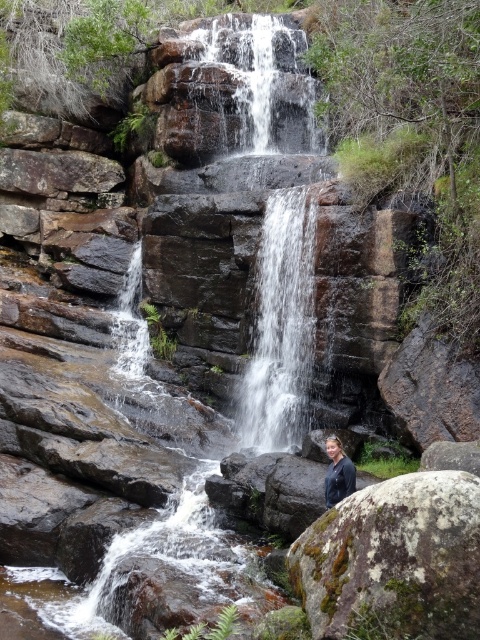
You are planning to cross the clear water at center to reach the mossy rock at lower right. Considering the width of both, which one is wider?

The mossy rock at lower right is wider than the clear water at center, so the mossy rock at lower right is wider.

You are a photographer trying to capture the waterfall scene. You notice the clear water at center and the dark blue jacket at center. Which object is positioned higher in the image?

The clear water at center is located above the dark blue jacket at center, so it is positioned higher in the image.